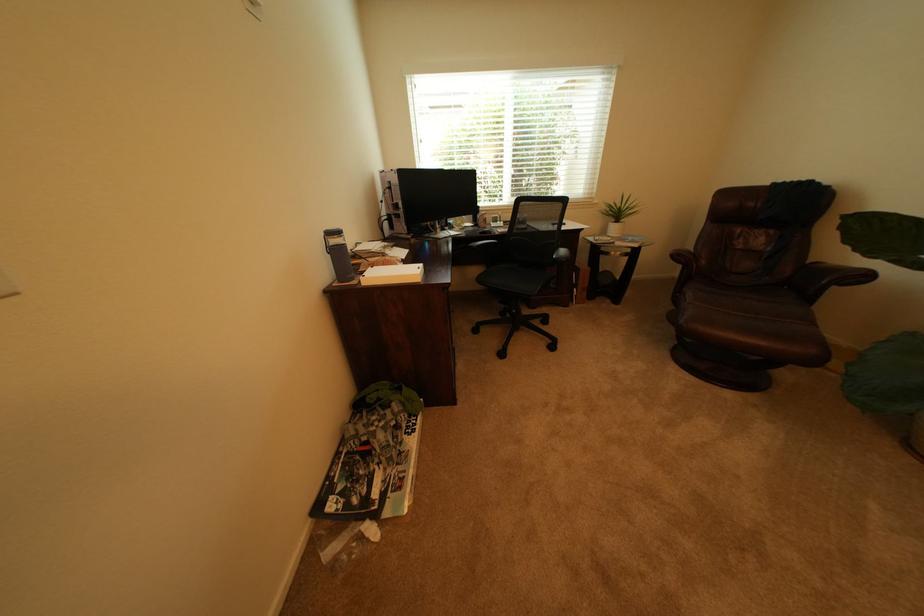
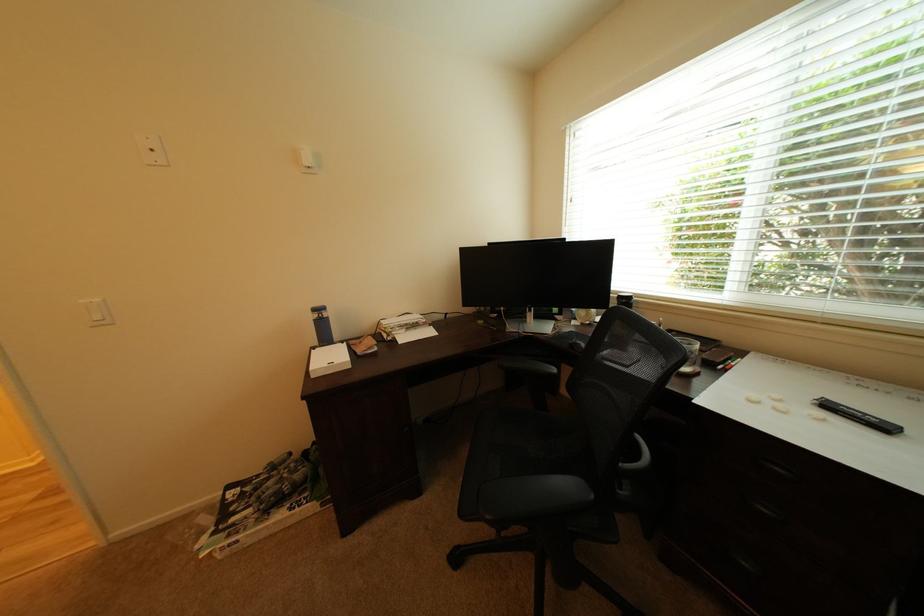
The point at (423, 477) is marked in the first image. Where is the corresponding point in the second image?

(248, 543)